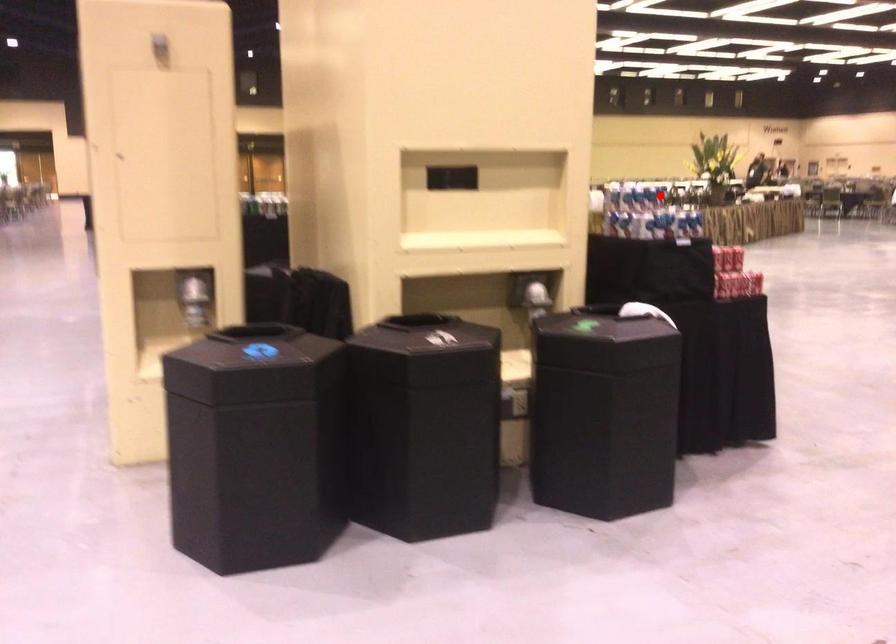
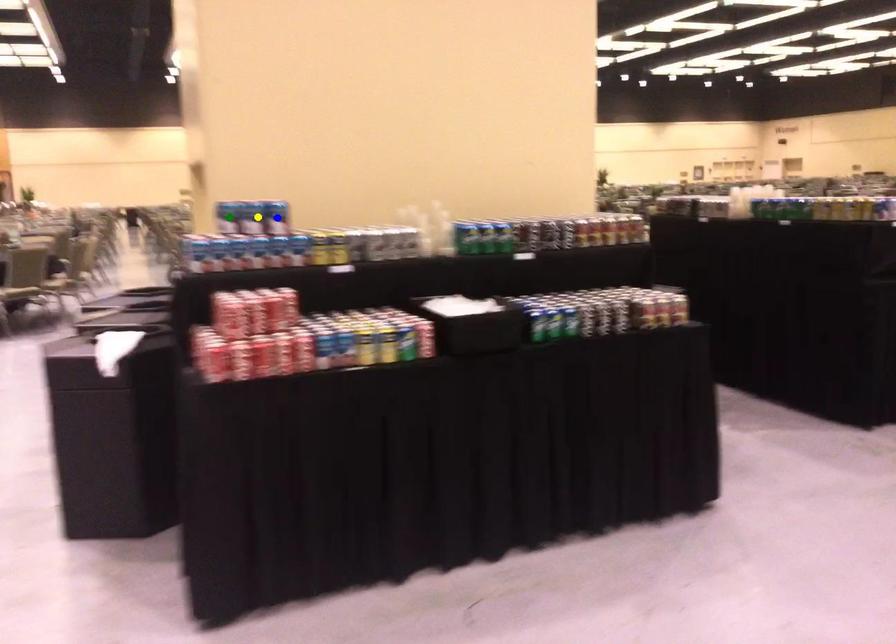
Question: I am providing you with two images of the same scene from different viewpoints. A red point is marked on the first image. You are given multiple points on the second image. Which spot in image 2 lines up with the point in image 1?

Choices:
 (A) green point
 (B) blue point
 (C) yellow point

Answer: (C)